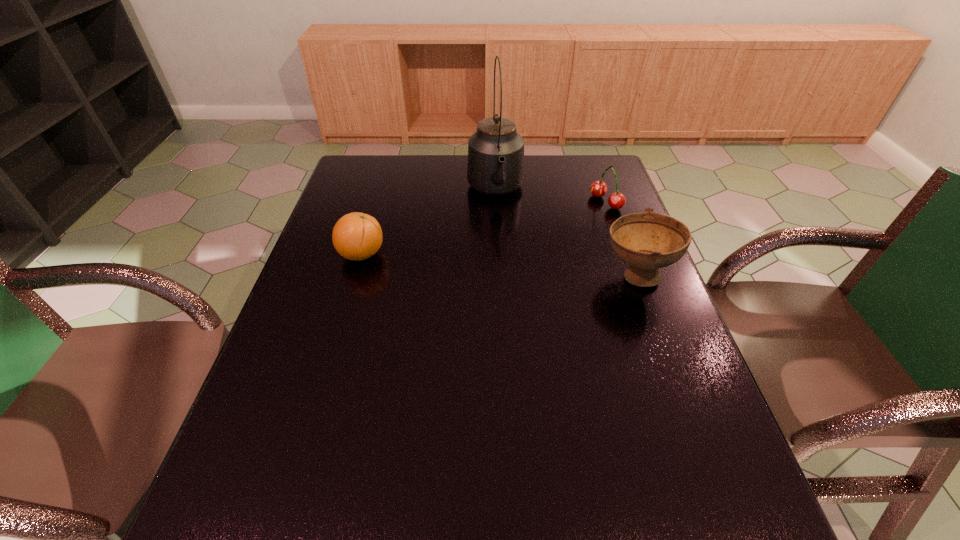
In order to click on free space at the left edge of the desktop in this screenshot , I will do `click(342, 210)`.

In the image, there is a desktop. At what (x,y) coordinates should I click in order to perform the action: click on vacant space at the right edge. Please return your answer as a coordinate pair (x, y). Looking at the image, I should click on (603, 225).

Locate an element on the screen. The width and height of the screenshot is (960, 540). vacant area at the near left corner is located at coordinates (255, 462).

The image size is (960, 540). What are the coordinates of `free space at the far right corner of the desktop` in the screenshot? It's located at (574, 191).

Image resolution: width=960 pixels, height=540 pixels. In the image, there is a desktop. Identify the location of free region at the near right corner. (688, 441).

Identify the location of vacant region between the orange and the tallest object. The width and height of the screenshot is (960, 540). (428, 222).

Locate an element on the screen. The image size is (960, 540). free area in between the soup bowl and the orange is located at coordinates (499, 265).

Locate an element on the screen. The image size is (960, 540). vacant point located between the cherry and the tallest object is located at coordinates (551, 197).

Find the location of a particular element. This screenshot has width=960, height=540. empty location between the third object from right to left and the cherry is located at coordinates (551, 197).

Locate an element on the screen. vacant space in between the second tallest object and the leftmost object is located at coordinates (499, 265).